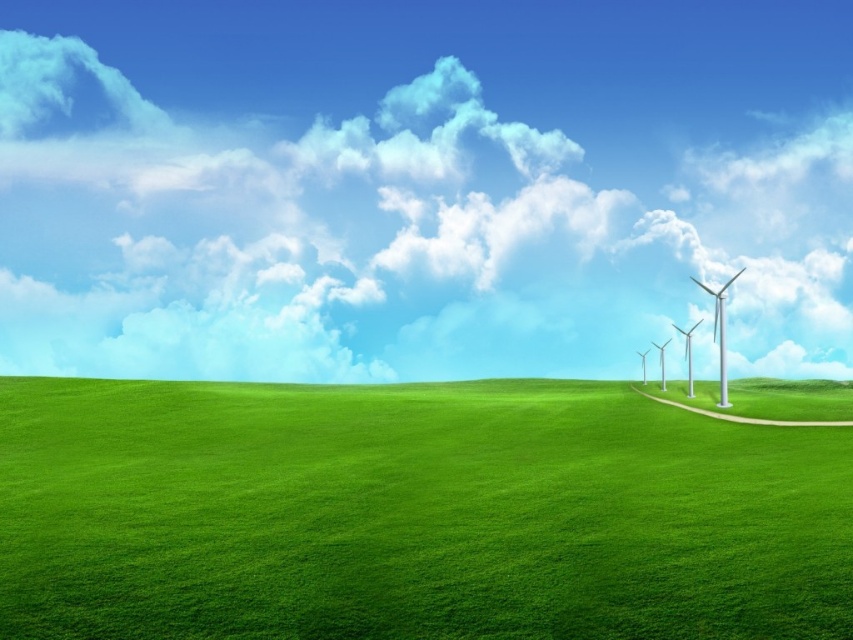
Is point (683, 337) positioned in front of point (663, 356)?

Yes, point (683, 337) is in front of point (663, 356).

Is metallic silver wind turbine at right below white metallic windmill at center-right?

No, metallic silver wind turbine at right is not below white metallic windmill at center-right.

The image size is (853, 640). I want to click on metallic silver wind turbine at right, so click(x=688, y=353).

Does white fluffy cloud at upper center lie behind green grassy field at center?

That is True.

Is point (281, 314) farther from viewer compared to point (711, 636)?

Yes, point (281, 314) is behind point (711, 636).

Find the location of a particular element. This screenshot has height=640, width=853. white fluffy cloud at upper center is located at coordinates (392, 236).

Is point (190, 454) positioned behind point (712, 314)?

That is False.

Is green grassy field at center bigger than silver metallic wind turbines at center-right?

Actually, green grassy field at center might be smaller than silver metallic wind turbines at center-right.

Does point (59, 440) come behind point (722, 291)?

No, (59, 440) is closer to viewer.

You are a GUI agent. You are given a task and a screenshot of the screen. Output one action in this format:
    pyautogui.click(x=<x>, y=<y>)
    Task: Click on the green grassy field at center
    
    Given the screenshot: What is the action you would take?
    pyautogui.click(x=410, y=515)